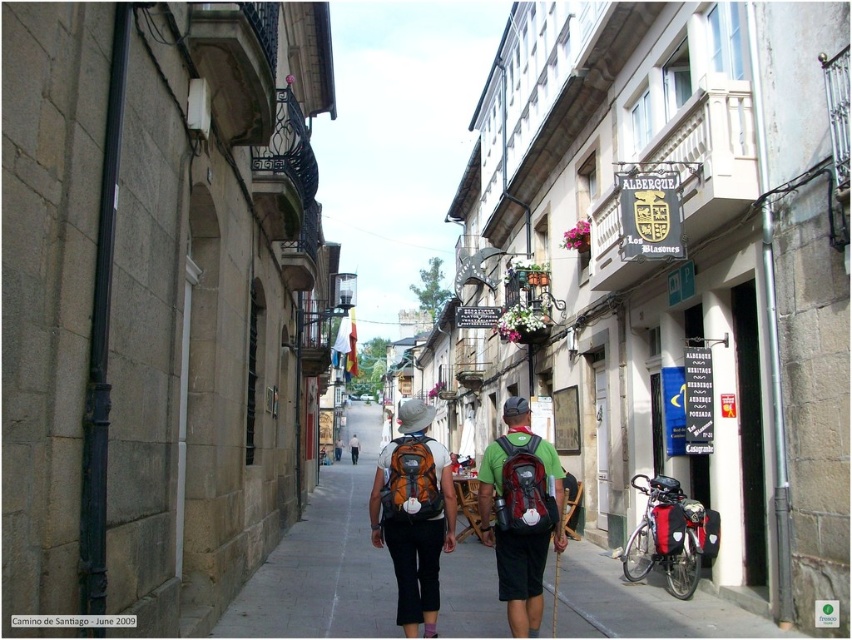
Locate an element on the screen. gray concrete pavement at center is located at coordinates (323, 563).

Can you confirm if gray concrete pavement at center is positioned to the left of matte orange backpack at center?

Correct, you'll find gray concrete pavement at center to the left of matte orange backpack at center.

Is point (281, 573) closer to camera compared to point (429, 584)?

No.

The width and height of the screenshot is (852, 640). In order to click on gray concrete pavement at center in this screenshot , I will do `click(323, 563)`.

Is matte orange backpack at center taller than matte green backpack at center?

Yes.

Which is more to the left, matte orange backpack at center or matte green backpack at center?

Positioned to the left is matte green backpack at center.

Between point (430, 586) and point (516, 611), which one is positioned in front?

Point (516, 611) is in front.

Identify the location of matte orange backpack at center. The image size is (852, 640). (521, 513).

Describe the element at coordinates (521, 513) in the screenshot. Image resolution: width=852 pixels, height=640 pixels. I see `matte orange backpack at center` at that location.

Does matte orange backpack at center appear on the right side of orange fabric backpack at center?

Yes, matte orange backpack at center is to the right of orange fabric backpack at center.

Who is more distant from viewer, [557,490] or [453,497]?

The point [453,497] is more distant.

Locate an element on the screen. matte orange backpack at center is located at coordinates (521, 513).